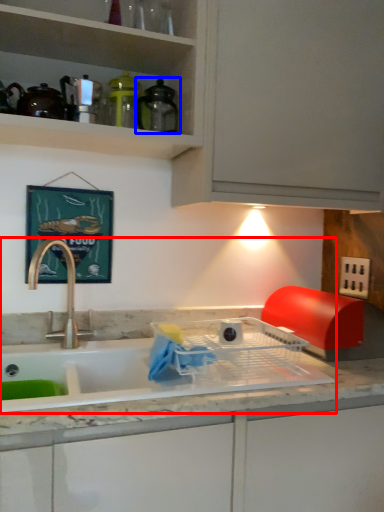
Question: Among these objects, which one is farthest to the camera, sink (highlighted by a red box) or appliance (highlighted by a blue box)?

Choices:
 (A) sink
 (B) appliance

Answer: (B)